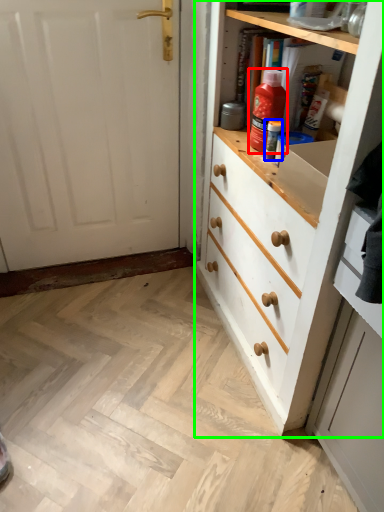
Question: Which is nearer to the cleaning product (highlighted by a red box)? bottle (highlighted by a blue box) or chest of drawers (highlighted by a green box).

Choices:
 (A) bottle
 (B) chest of drawers

Answer: (A)